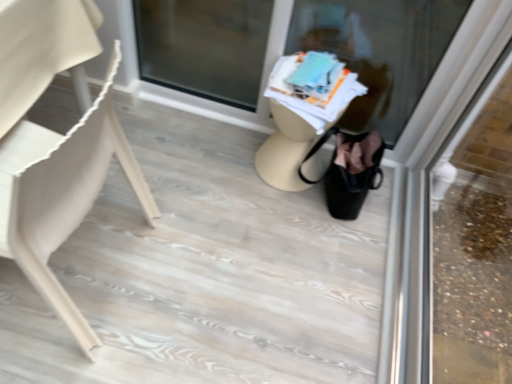
Locate an element on the screen. This screenshot has width=512, height=384. free space to the right of matte beige chair at left is located at coordinates (200, 277).